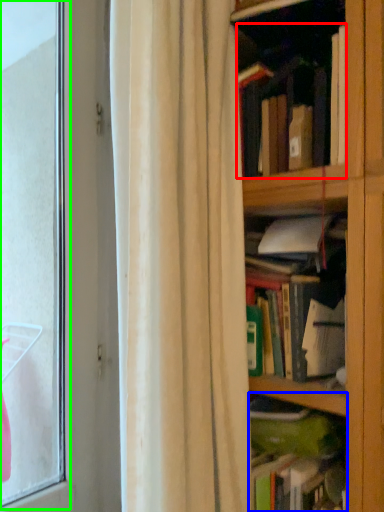
Question: Considering the real-world distances, which object is closest to book (highlighted by a red box)? book (highlighted by a blue box) or bay window (highlighted by a green box).

Choices:
 (A) book
 (B) bay window

Answer: (A)